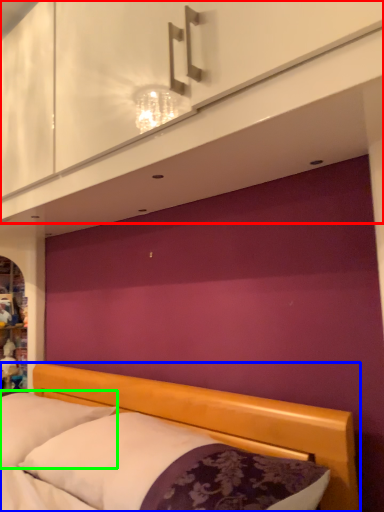
Question: Which object is the closest to the dresser (highlighted by a red box)? Choose among these: bed (highlighted by a blue box) or pillow (highlighted by a green box).

Choices:
 (A) bed
 (B) pillow

Answer: (A)